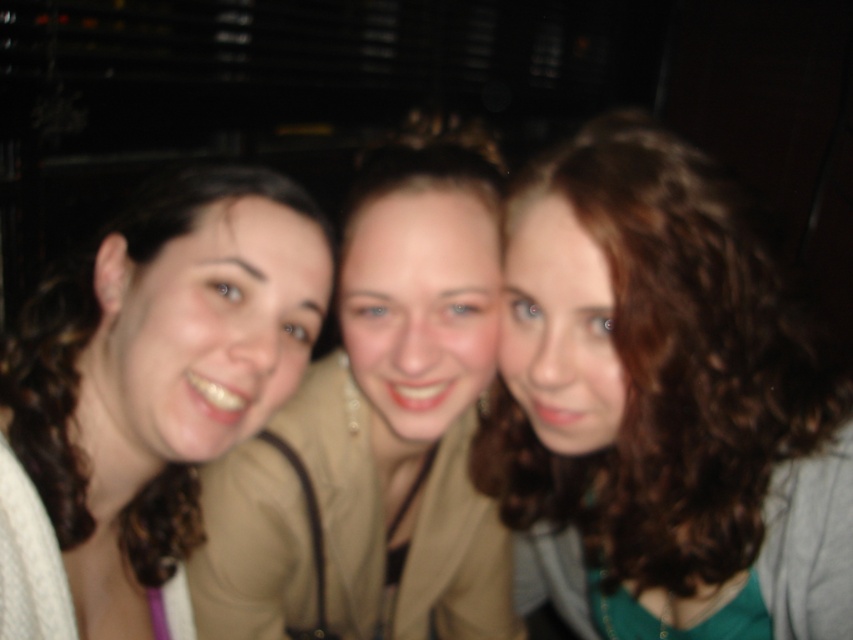
Does curly brown hair at center have a lesser width compared to matte beige shirt at left?

No, curly brown hair at center is not thinner than matte beige shirt at left.

Can you confirm if curly brown hair at center is taller than matte beige shirt at left?

Yes, curly brown hair at center is taller than matte beige shirt at left.

At what (x,y) coordinates should I click in order to perform the action: click on curly brown hair at center. Please return your answer as a coordinate pair (x, y). This screenshot has width=853, height=640. Looking at the image, I should click on (662, 404).

Can you confirm if curly brown hair at center is wider than matte beige blazer at center?

Correct, the width of curly brown hair at center exceeds that of matte beige blazer at center.

Can you confirm if curly brown hair at center is positioned above matte beige blazer at center?

Incorrect, curly brown hair at center is not positioned above matte beige blazer at center.

The width and height of the screenshot is (853, 640). Describe the element at coordinates (662, 404) in the screenshot. I see `curly brown hair at center` at that location.

Find the location of a particular element. curly brown hair at center is located at coordinates (662, 404).

Who is taller, matte beige shirt at left or matte beige blazer at center?

With more height is matte beige blazer at center.

I want to click on matte beige shirt at left, so click(148, 396).

This screenshot has width=853, height=640. In order to click on matte beige shirt at left in this screenshot , I will do `click(148, 396)`.